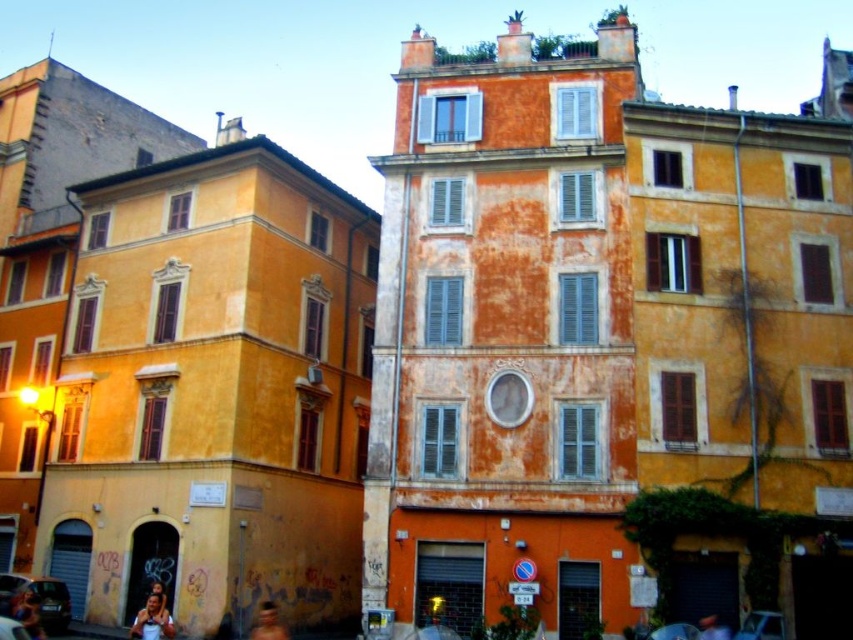
You are standing in the vibrant urban scene and notice the blue denim jeans at lower left. Can you determine their exact location using the coordinate system provided?

The blue denim jeans at lower left are located at point (28, 614).

You are a photographer capturing the urban scene. You notice two people in the foreground. One has a smooth skin face at lower left and the other has blurred skin at lower center. Which person is positioned more to the left side of the image?

The smooth skin face at lower left is positioned more to the left side of the image compared to the blurred skin at lower center.

You are a photographer standing in the middle of the urban scene. You notice the blue denim jeans at lower left and the blurred skin at lower center in your viewfinder. Which object appears taller in the frame?

The blue denim jeans at lower left appears taller than the blurred skin at lower center in the frame.